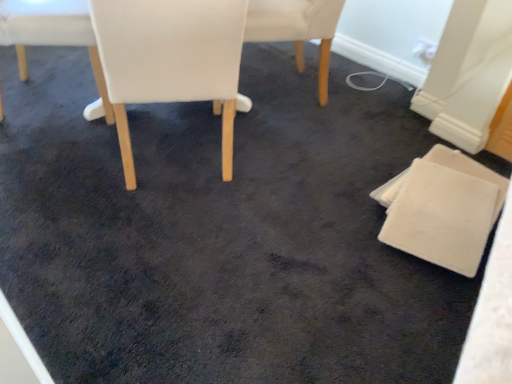
Question: Visually, is white leather chair at center, marked as the 2th chair in a right-to-left arrangement, positioned to the left or to the right of white felt coaster at lower right, placed as the 1th chair when sorted from right to left?

Choices:
 (A) right
 (B) left

Answer: (B)

Question: From a real-world perspective, is white leather chair at center, marked as the 2th chair in a right-to-left arrangement, positioned above or below white felt coaster at lower right, which appears as the fourth chair when viewed from the left?

Choices:
 (A) above
 (B) below

Answer: (A)

Question: Considering the real-world distances, which object is farthest from the white leather chair at center, the 2th chair viewed from the left?

Choices:
 (A) white fabric chair at upper left, placed as the 1th chair when sorted from left to right
 (B) white leather chair at center, marked as the 2th chair in a right-to-left arrangement
 (C) white felt coaster at lower right, placed as the 1th chair when sorted from right to left

Answer: (C)

Question: Which of these objects is positioned closest to the white leather chair at center, marked as the 2th chair in a right-to-left arrangement?

Choices:
 (A) white leather chair at center, the 2th chair viewed from the left
 (B) white fabric chair at upper left, acting as the 4th chair starting from the right
 (C) white felt coaster at lower right, which appears as the fourth chair when viewed from the left

Answer: (A)